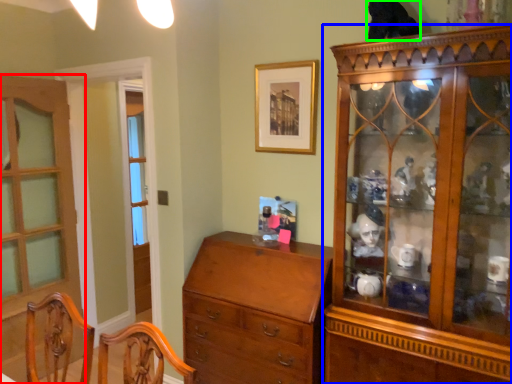
Question: Which is farther away from door (highlighted by a red box)? cabinetry (highlighted by a blue box) or animal (highlighted by a green box)?

Choices:
 (A) cabinetry
 (B) animal

Answer: (B)